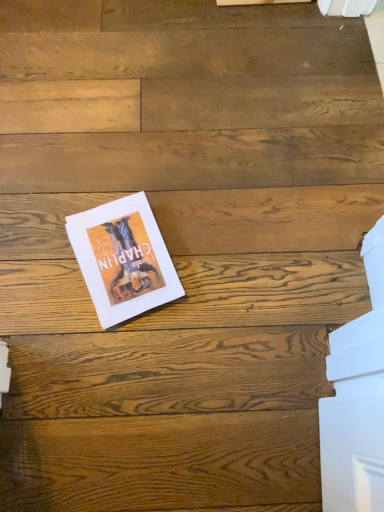
What do you see at coordinates (123, 259) in the screenshot?
I see `white paper book at center` at bounding box center [123, 259].

Find the location of a particular element. The height and width of the screenshot is (512, 384). white paper book at center is located at coordinates point(123,259).

Find the location of a particular element. white paper book at center is located at coordinates (123, 259).